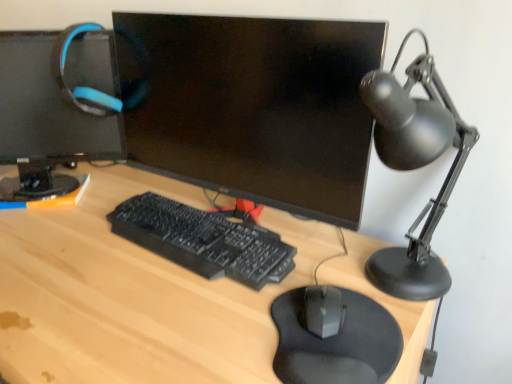
Question: Does light wood desk at center have a greater height compared to matte black monitor at center, acting as the 1th computer monitor starting from the right?

Choices:
 (A) no
 (B) yes

Answer: (B)

Question: Does light wood desk at center have a lesser width compared to matte black monitor at center, acting as the 1th computer monitor starting from the right?

Choices:
 (A) yes
 (B) no

Answer: (B)

Question: Is light wood desk at center behind matte black monitor at center, acting as the 1th computer monitor starting from the right?

Choices:
 (A) no
 (B) yes

Answer: (A)

Question: From a real-world perspective, is light wood desk at center under matte black monitor at center, acting as the 2th computer monitor starting from the left?

Choices:
 (A) yes
 (B) no

Answer: (A)

Question: Does light wood desk at center lie in front of matte black monitor at center, acting as the 1th computer monitor starting from the right?

Choices:
 (A) no
 (B) yes

Answer: (B)

Question: In terms of size, does black matte desk lamp at right appear bigger or smaller than black matte mousepad at lower center?

Choices:
 (A) small
 (B) big

Answer: (B)

Question: Considering their positions, is black matte desk lamp at right located in front of or behind black matte mousepad at lower center?

Choices:
 (A) front
 (B) behind

Answer: (A)

Question: From their relative heights in the image, would you say black matte desk lamp at right is taller or shorter than black matte mousepad at lower center?

Choices:
 (A) short
 (B) tall

Answer: (B)

Question: Based on their positions, is black matte desk lamp at right located to the left or right of black matte mousepad at lower center?

Choices:
 (A) right
 (B) left

Answer: (A)

Question: From the image's perspective, is matte black monitor at upper left, placed as the 1th computer monitor when sorted from left to right, positioned above or below matte black monitor at center, acting as the 1th computer monitor starting from the right?

Choices:
 (A) above
 (B) below

Answer: (A)

Question: Choose the correct answer: Is matte black monitor at upper left, which is the second computer monitor from right to left, inside matte black monitor at center, acting as the 1th computer monitor starting from the right, or outside it?

Choices:
 (A) inside
 (B) outside

Answer: (B)

Question: Based on their positions, is matte black monitor at upper left, placed as the 1th computer monitor when sorted from left to right, located to the left or right of matte black monitor at center, acting as the 2th computer monitor starting from the left?

Choices:
 (A) right
 (B) left

Answer: (B)

Question: Looking at their shapes, would you say matte black monitor at upper left, placed as the 1th computer monitor when sorted from left to right, is wider or thinner than matte black monitor at center, acting as the 1th computer monitor starting from the right?

Choices:
 (A) thin
 (B) wide

Answer: (B)

Question: Choose the correct answer: Is black matte desk lamp at right inside black plastic keyboard at center or outside it?

Choices:
 (A) inside
 (B) outside

Answer: (B)

Question: Visually, is black matte desk lamp at right positioned to the left or to the right of black plastic keyboard at center?

Choices:
 (A) left
 (B) right

Answer: (B)